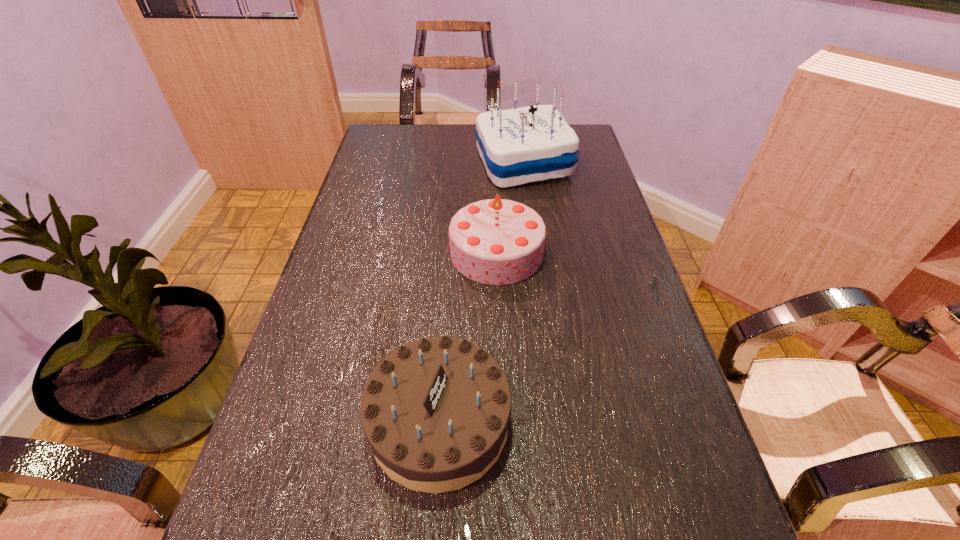
Locate an element on the screen. This screenshot has height=540, width=960. the farthest birthday cake is located at coordinates (517, 146).

The image size is (960, 540). I want to click on the tallest birthday cake, so click(517, 146).

The height and width of the screenshot is (540, 960). Identify the location of the second farthest birthday cake. (495, 241).

The width and height of the screenshot is (960, 540). Identify the location of the second farthest object. (495, 241).

Locate an element on the screen. the nearest object is located at coordinates (436, 411).

Identify the location of the nearest birthday cake. This screenshot has height=540, width=960. (436, 411).

Where is `free space located 0.060m on the left of the tallest object`? free space located 0.060m on the left of the tallest object is located at coordinates (456, 163).

Identify the location of blank space located 0.220m on the back of the second tallest object. This screenshot has width=960, height=540. (493, 178).

Where is `free space located on the front-facing side of the shortest object`? free space located on the front-facing side of the shortest object is located at coordinates coord(576,422).

Image resolution: width=960 pixels, height=540 pixels. Find the location of `object located in the far edge section of the desktop`. object located in the far edge section of the desktop is located at coordinates (517, 146).